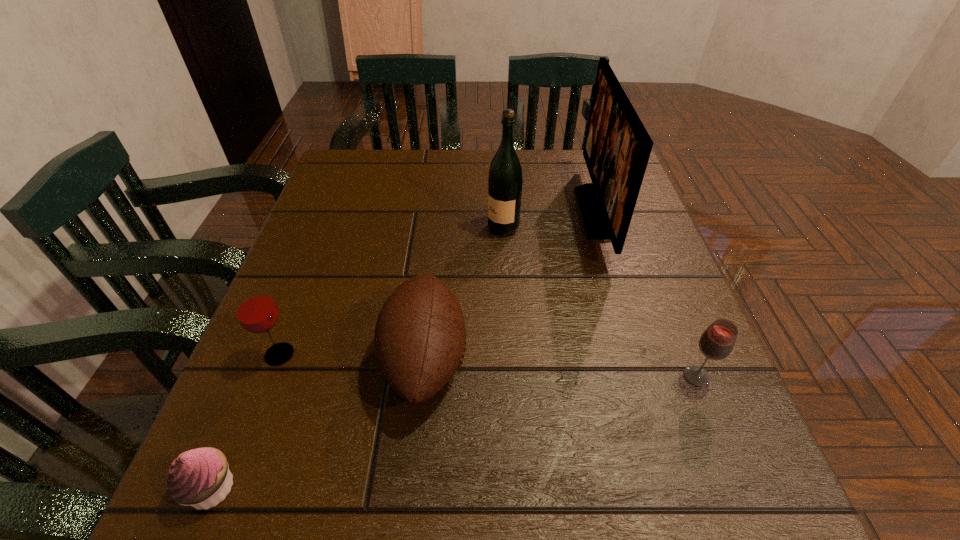
The width and height of the screenshot is (960, 540). Identify the location of glass situated at the left edge. (256, 311).

In order to click on cupcake at the left edge in this screenshot , I will do `click(200, 477)`.

Locate an element on the screen. monitor positioned at the right edge is located at coordinates (617, 147).

The image size is (960, 540). Identify the location of glass drink container present at the right edge. (716, 343).

At what (x,y) coordinates should I click in order to perform the action: click on object positioned at the near left corner. Please return your answer as a coordinate pair (x, y). The image size is (960, 540). Looking at the image, I should click on (200, 477).

Identify the location of object that is positioned at the far right corner. This screenshot has width=960, height=540. (617, 147).

In the image, there is a desktop. Find the location of `free space at the far edge`. free space at the far edge is located at coordinates (477, 181).

Locate an element on the screen. free space at the near edge of the desktop is located at coordinates (552, 501).

You are a GUI agent. You are given a task and a screenshot of the screen. Output one action in this format:
    pyautogui.click(x=<x>, y=<y>)
    Task: Click on the free space at the left edge of the desktop
    
    Given the screenshot: What is the action you would take?
    pyautogui.click(x=341, y=208)

Image resolution: width=960 pixels, height=540 pixels. Identify the location of vacant region at the right edge of the desktop. (668, 281).